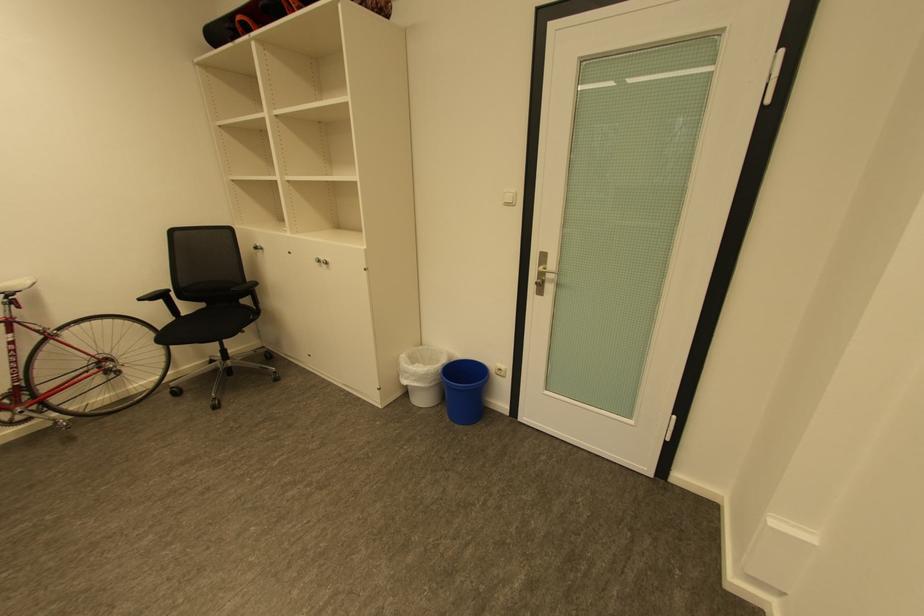
Find the location of `white light switch`. white light switch is located at coordinates (508, 198).